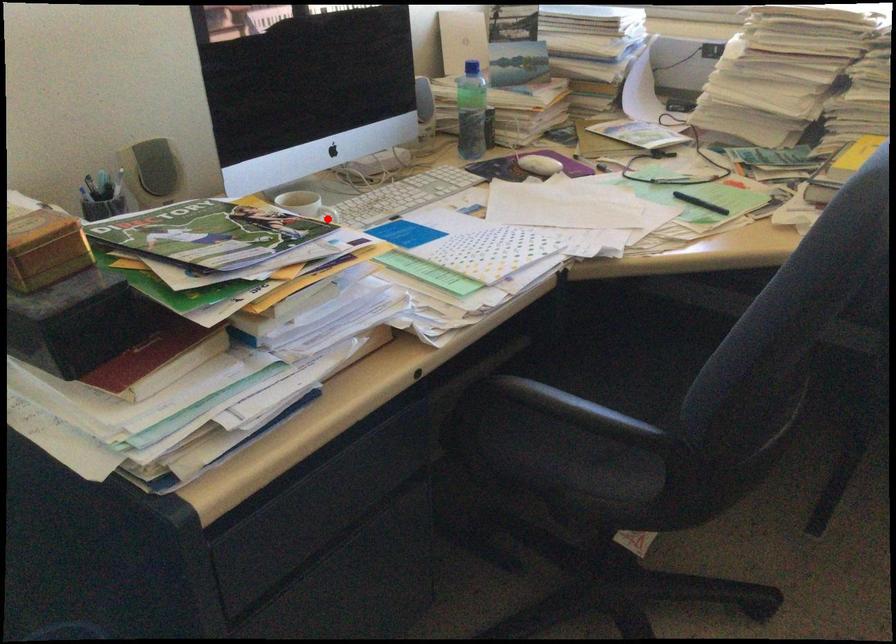
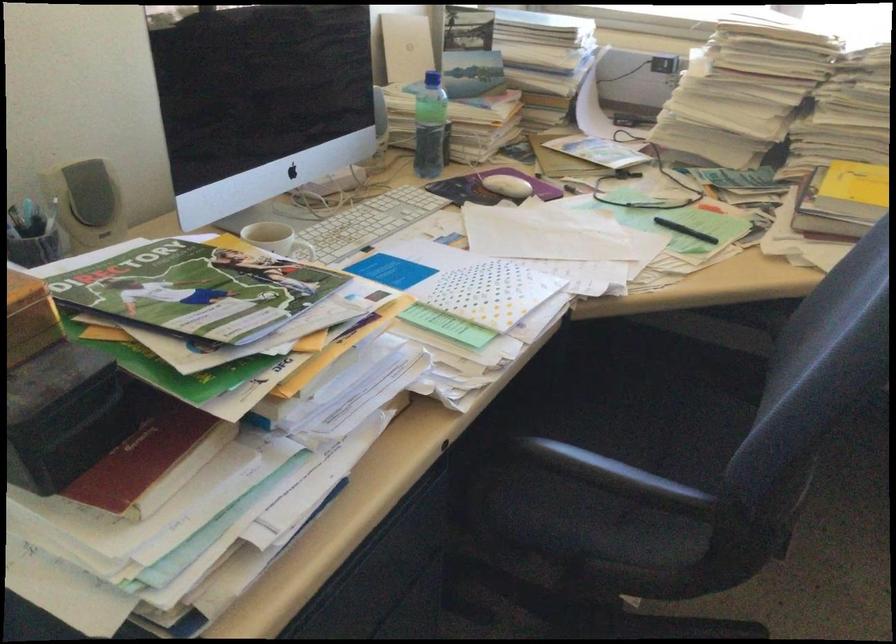
Locate, in the second image, the point that corresponds to the highlighted location in the first image.

(306, 252)